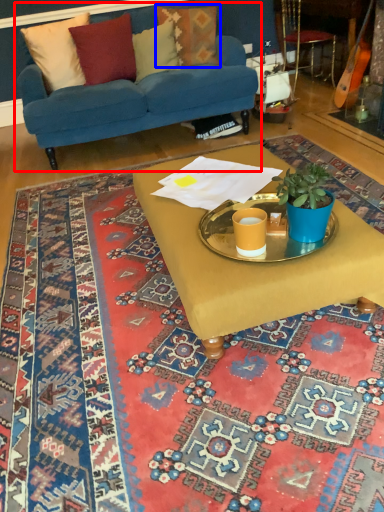
Question: Which of the following is the closest to the observer, studio couch (highlighted by a red box) or pillow (highlighted by a blue box)?

Choices:
 (A) studio couch
 (B) pillow

Answer: (A)